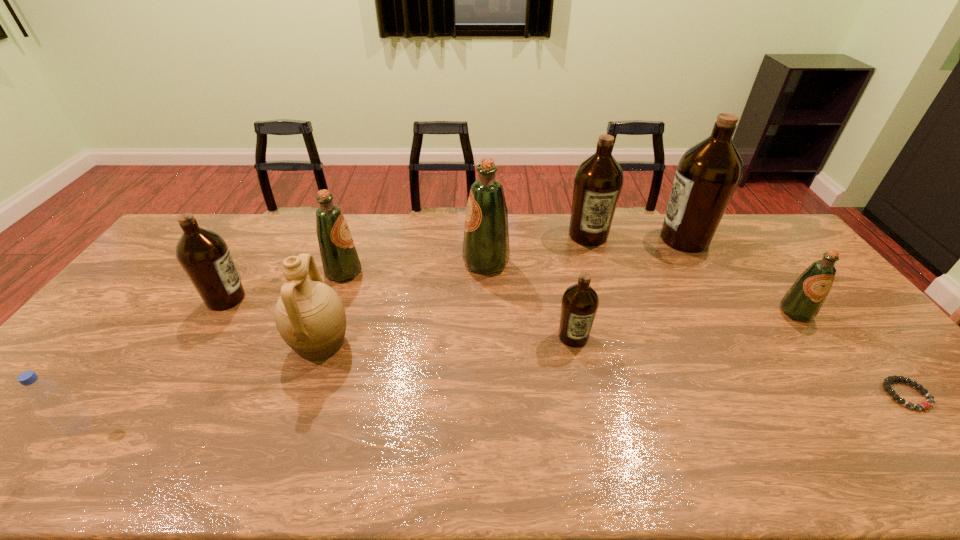
Find the location of a particular element. vacant space located on the front-facing side of the rightmost olive oil is located at coordinates (814, 337).

Where is `vacant space located on the back of the nearest object`? Image resolution: width=960 pixels, height=540 pixels. vacant space located on the back of the nearest object is located at coordinates (156, 326).

This screenshot has height=540, width=960. I want to click on vacant space situated on the left of the shortest object, so click(733, 394).

The width and height of the screenshot is (960, 540). I want to click on object positioned at the near edge, so click(x=66, y=415).

Where is `object at the left edge`? The width and height of the screenshot is (960, 540). object at the left edge is located at coordinates (66, 415).

At what (x,y) coordinates should I click in order to perform the action: click on olive oil present at the right edge. Please return your answer as a coordinate pair (x, y). The height and width of the screenshot is (540, 960). Looking at the image, I should click on (802, 302).

Identify the location of bracelet located in the right edge section of the desktop. (887, 382).

Find the location of a particular element. Image resolution: width=960 pixels, height=540 pixels. object at the near left corner is located at coordinates (66, 415).

This screenshot has width=960, height=540. Identify the location of vacant area at the far edge of the desktop. (448, 216).

In the image, there is a desktop. Where is `free space at the near edge`? This screenshot has height=540, width=960. free space at the near edge is located at coordinates (871, 476).